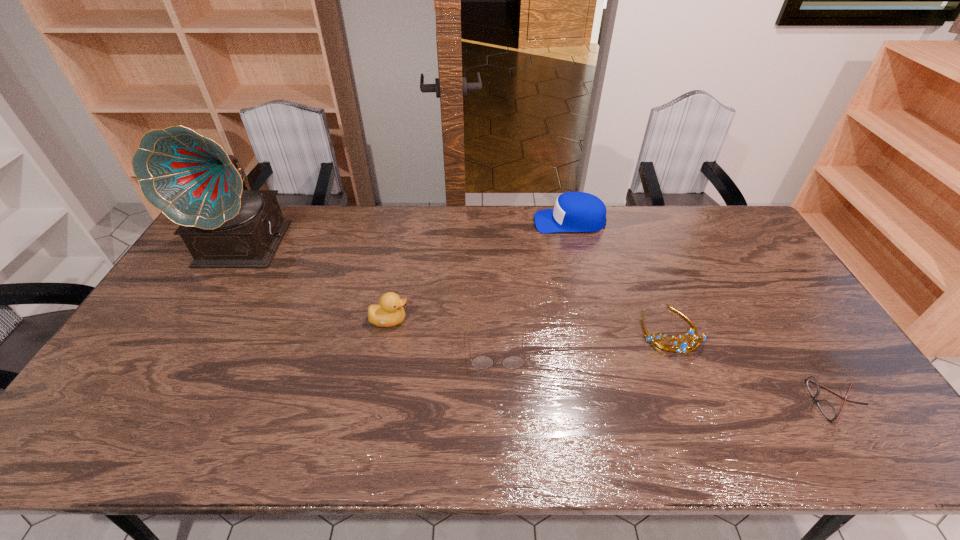
Where is `baseball cap present at the far edge`? This screenshot has height=540, width=960. baseball cap present at the far edge is located at coordinates (573, 211).

You are a GUI agent. You are given a task and a screenshot of the screen. Output one action in this format:
    pyautogui.click(x=<x>, y=<y>)
    Task: Click on the object situated at the near edge
    The width and height of the screenshot is (960, 540).
    Given the screenshot: What is the action you would take?
    pyautogui.click(x=827, y=409)

The width and height of the screenshot is (960, 540). Identify the location of object that is at the left edge. (190, 178).

Find the location of a particular element. The image size is (960, 540). object situated at the right edge is located at coordinates click(x=827, y=409).

You are a GUI agent. You are given a task and a screenshot of the screen. Output one action in this format:
    pyautogui.click(x=<x>, y=<y>)
    Task: Click on the object present at the far left corner
    The width and height of the screenshot is (960, 540).
    Given the screenshot: What is the action you would take?
    pyautogui.click(x=190, y=178)

I want to click on object located at the near right corner, so click(827, 409).

Find the location of a particular element. blank area at the far edge is located at coordinates (422, 232).

At what (x,y) coordinates should I click in order to perform the action: click on vacant space at the left edge. Please return your answer as a coordinate pair (x, y). Looking at the image, I should click on (180, 305).

This screenshot has height=540, width=960. Find the location of `free region at the right edge of the desktop`. free region at the right edge of the desktop is located at coordinates (819, 362).

Identify the location of blank region between the baseball cap and the right spectacles. This screenshot has height=540, width=960. (702, 312).